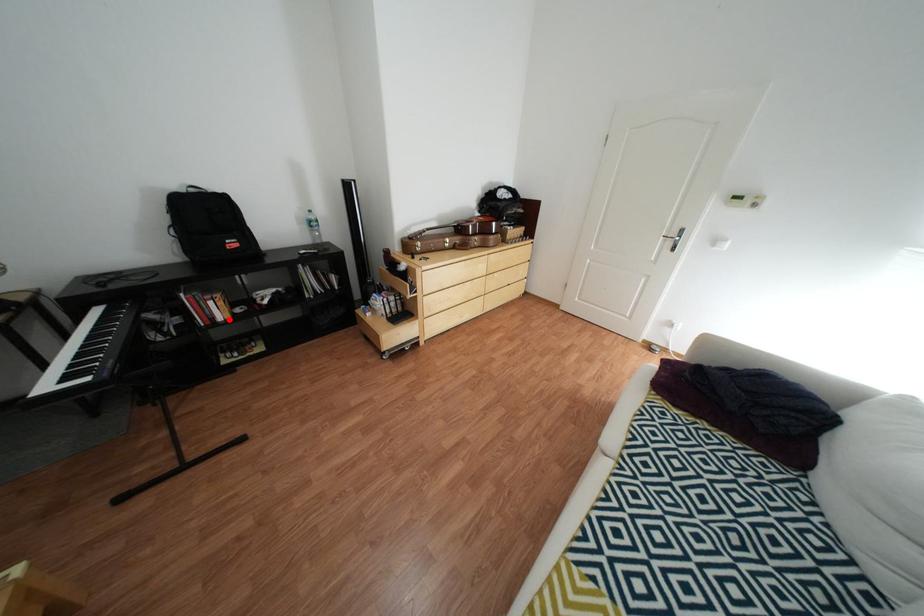
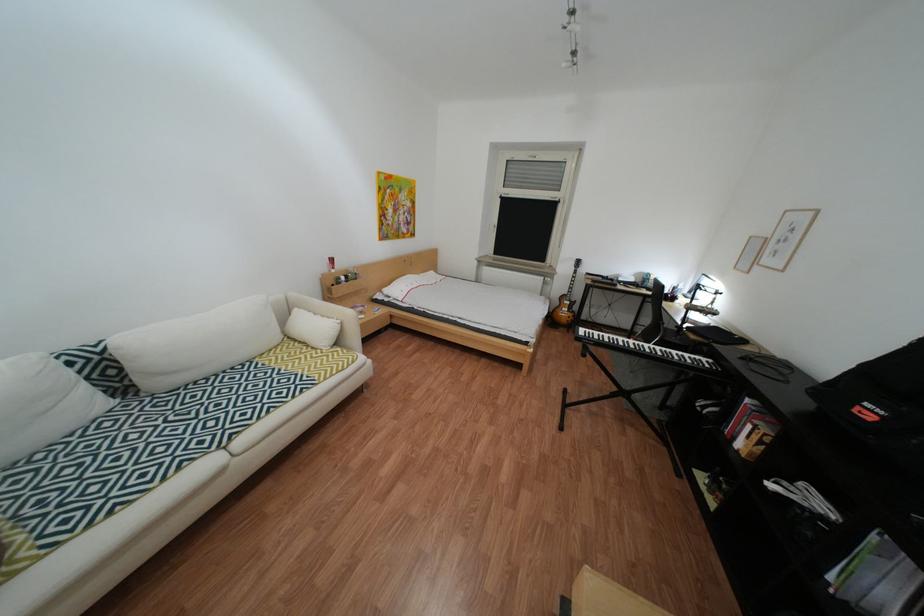
Question: I am providing you with two images of the same scene from different viewpoints. A red point is marked on the first image. Is the red point's position out of view in image 2?

Choices:
 (A) Yes
 (B) No

Answer: (B)